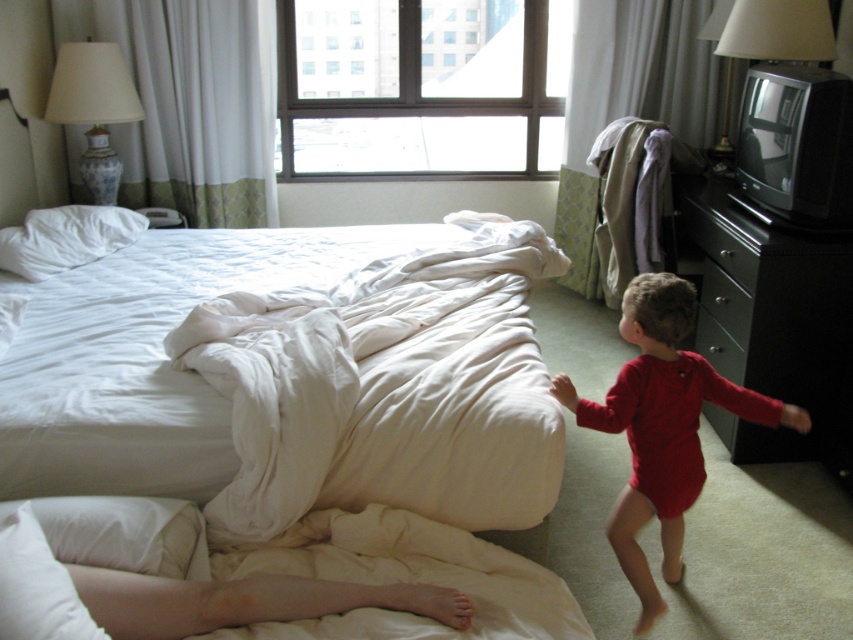
Is point (747, 51) more distant than point (728, 426)?

Yes, point (747, 51) is farther from viewer.

Locate an element on the screen. This screenshot has width=853, height=640. metallic silver lamp at upper right is located at coordinates pos(766,38).

Who is higher up, white soft pillow at lower left or metallic silver drawer at right?

metallic silver drawer at right is higher up.

Does point (28, 604) come closer to viewer compared to point (734, 289)?

That is True.

Between point (42, 538) and point (711, 288), which one is positioned in front?

Point (42, 538) is in front.

Find the location of a particular element. Image resolution: width=853 pixels, height=640 pixels. white soft pillow at lower left is located at coordinates (36, 586).

Between white soft bed at center and metallic silver lamp at upper right, which one appears on the left side from the viewer's perspective?

From the viewer's perspective, white soft bed at center appears more on the left side.

The height and width of the screenshot is (640, 853). In order to click on white soft bed at center in this screenshot , I will do `click(293, 378)`.

Image resolution: width=853 pixels, height=640 pixels. What are the coordinates of `white soft bed at center` in the screenshot? It's located at (293, 378).